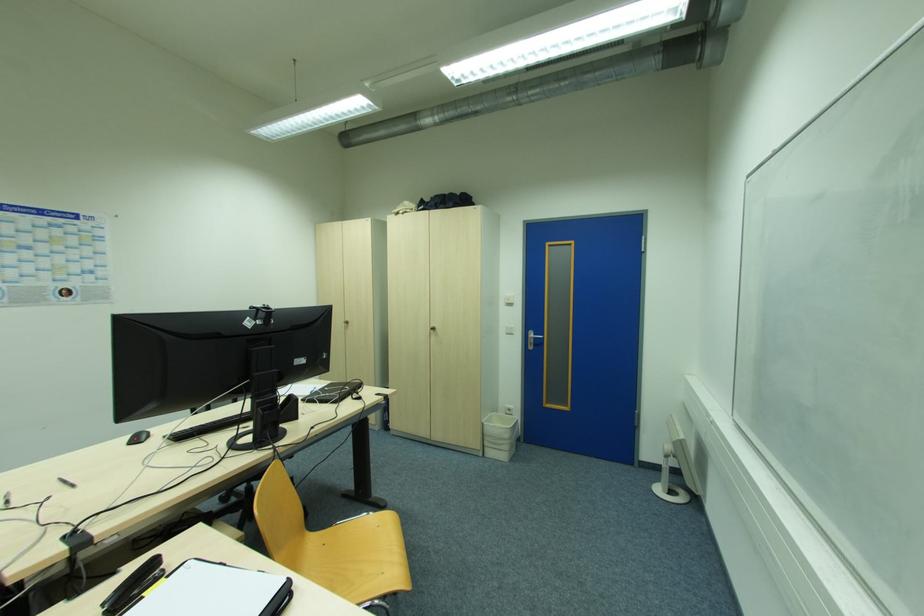
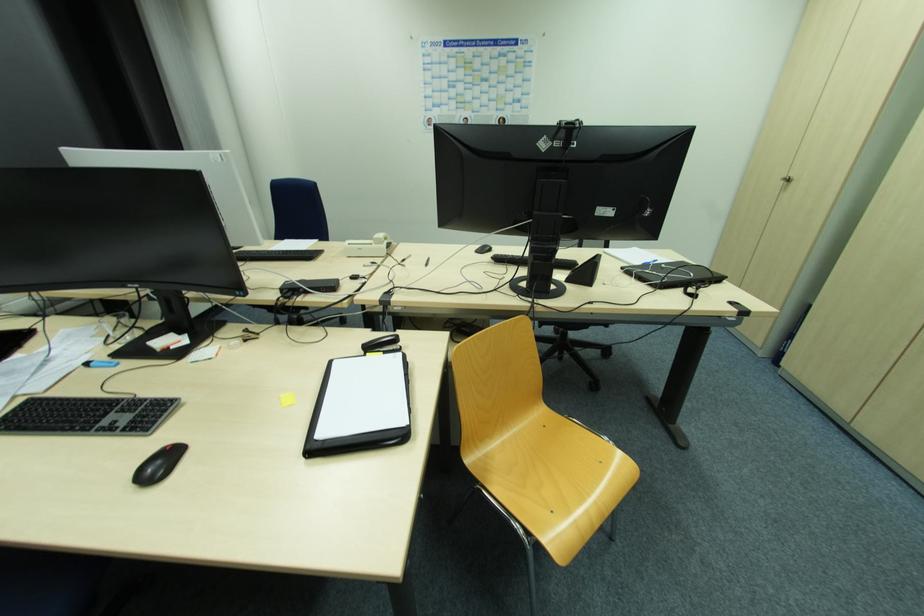
In the second image, find the point that corresponds to (346,325) in the first image.

(784, 183)